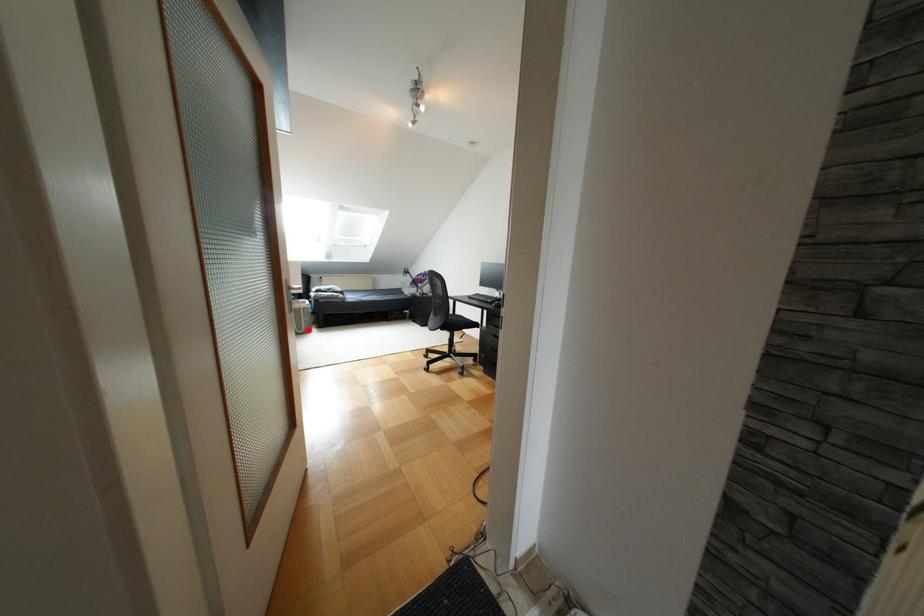
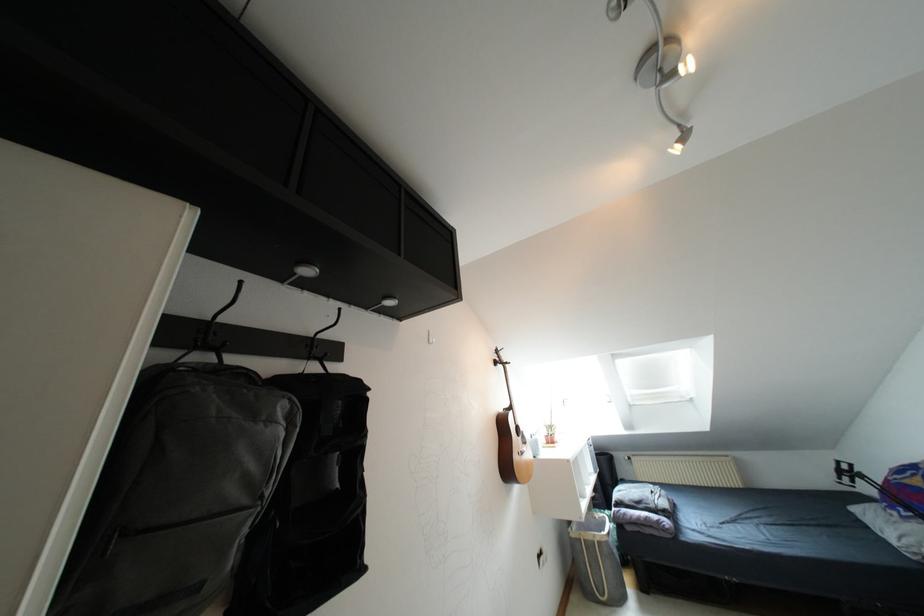
Locate, in the second image, the point that corresponds to the highlighted location in the first image.

(618, 599)